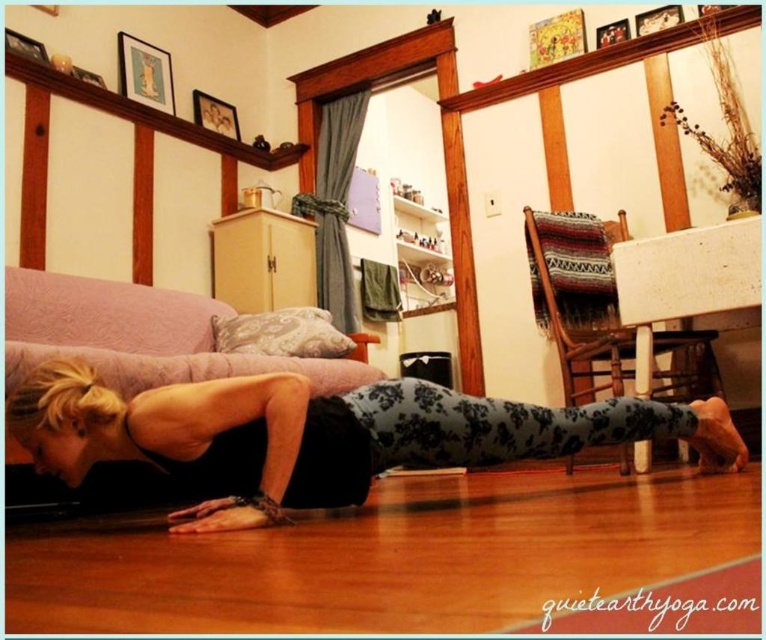
Based on the photo, you are a photographer setting up a shoot in this room. You need to place a light source to the right of the black floral leggings at lower center and to the left of the pink fabric couch at lower left. Is this possible given their positions?

The black floral leggings at lower center is positioned on the right side of the pink fabric couch at lower left. Therefore, placing a light source to the right of the black floral leggings at lower center would be further right than the leggings, but since the leggings are already to the right of the couch, there is no space between them to place the light as required. Thus, it is not possible to position the light between them as specified.

You are a photographer setting up a shoot in this room. You need to position a large camera tripod between the black floral leggings at lower center and the pink fabric couch at lower left. Considering their heights, which object should the tripod be placed closer to to ensure stability?

The black floral leggings at lower center is taller than the pink fabric couch at lower left, so the tripod should be placed closer to the black floral leggings at lower center to ensure stability as it provides a higher base.